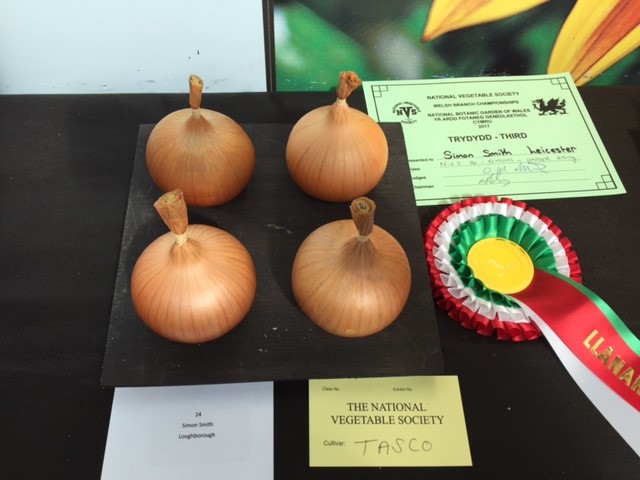
Find the location of a particular element. The width and height of the screenshot is (640, 480). white background wall is located at coordinates (66, 45), (157, 13), (203, 54).